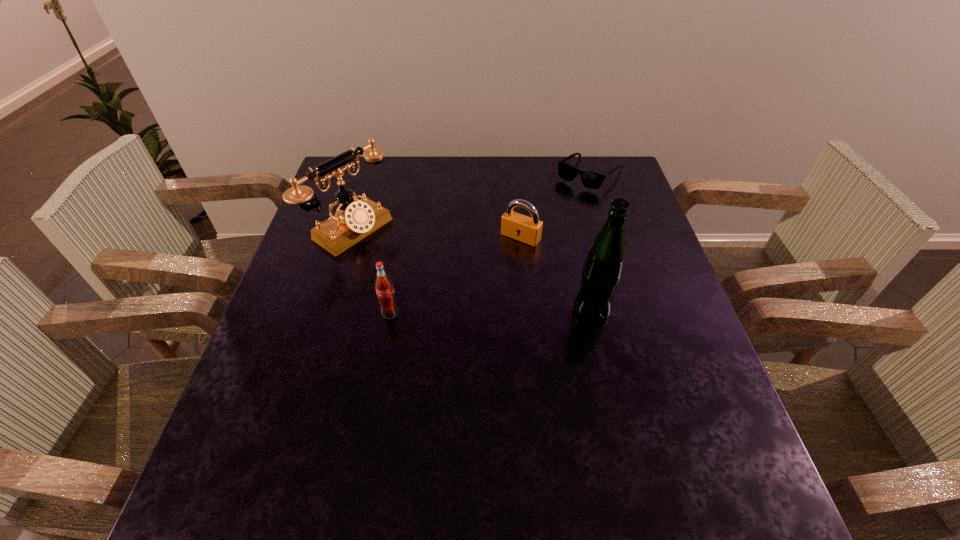
I want to click on free space between the fourth shortest object and the third object from right to left, so click(436, 234).

Where is `vacant point located between the fourth tallest object and the shortest object`? vacant point located between the fourth tallest object and the shortest object is located at coordinates (555, 205).

Identify the location of free area in between the shortest object and the padlock. point(555,205).

This screenshot has height=540, width=960. I want to click on free spot between the fourth object from right to left and the leftmost object, so click(371, 272).

Identify the location of free space between the leftmost object and the tallest object. (471, 271).

This screenshot has width=960, height=540. Identify the location of unoccupied area between the shortest object and the leftmost object. (470, 202).

The image size is (960, 540). Identify the location of vacant region between the third shortest object and the tallest object. (491, 312).

The image size is (960, 540). Find the location of `empty location between the beer bottle and the third object from left to right`. empty location between the beer bottle and the third object from left to right is located at coordinates (556, 274).

This screenshot has height=540, width=960. Identify the location of vacant space that's between the fourth object from right to left and the beer bottle. (491, 312).

Image resolution: width=960 pixels, height=540 pixels. In order to click on the closest object to the leftmost object in this screenshot , I will do `click(385, 292)`.